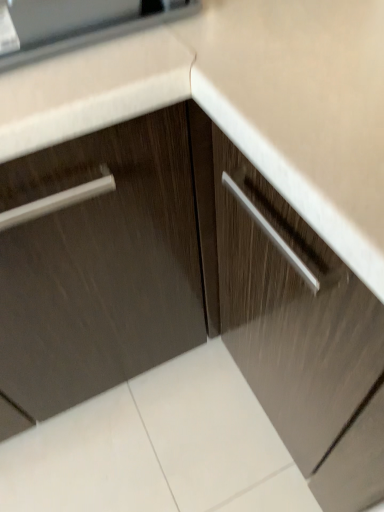
This screenshot has height=512, width=384. Find the location of `matte wood cabinet at center`. matte wood cabinet at center is located at coordinates (301, 335).

The image size is (384, 512). Describe the element at coordinates (301, 335) in the screenshot. I see `matte wood cabinet at center` at that location.

I want to click on matte wood cabinet at center, so click(301, 335).